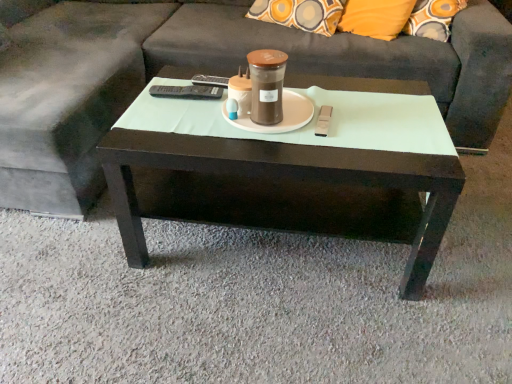
You are a GUI agent. You are given a task and a screenshot of the screen. Output one action in this format:
    pyautogui.click(x=<x>, y=<y>)
    Task: Click on the vacant area situated to the left side of white matte saucer at center
    
    Given the screenshot: What is the action you would take?
    pyautogui.click(x=178, y=113)